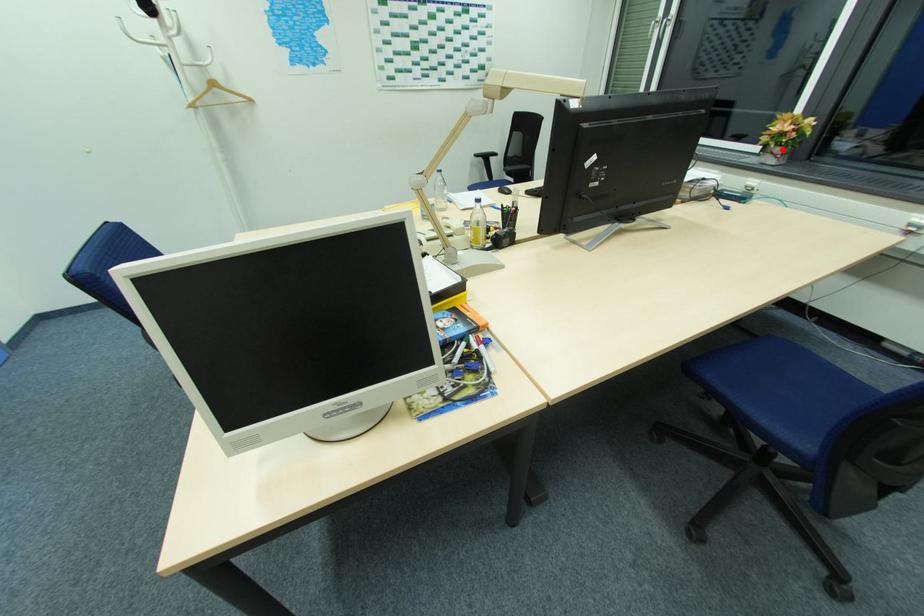
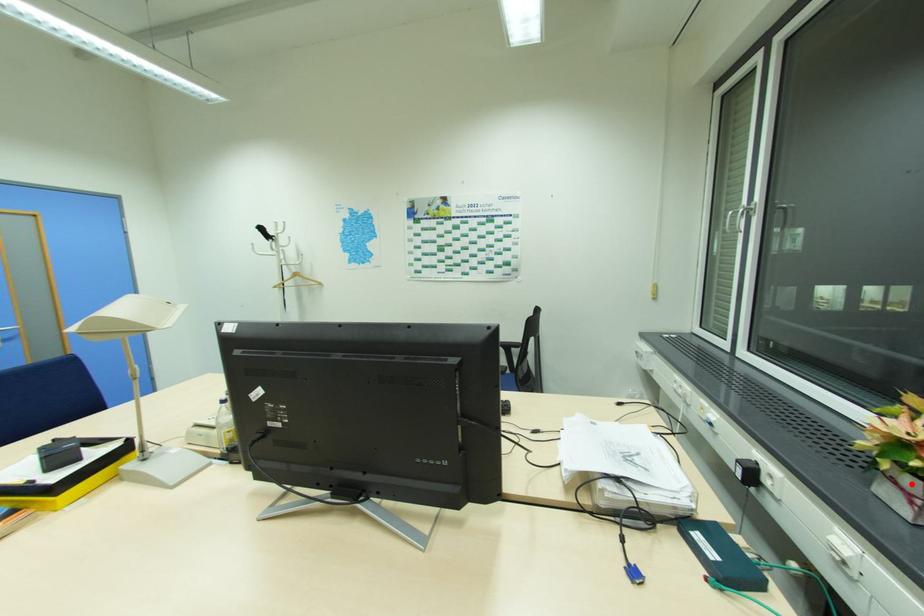
I am providing you with two images of the same scene from different viewpoints. A red point is marked on the first image and another point is marked on the second image. Does the point marked in image1 correspond to the same location as the one in image2?

Yes